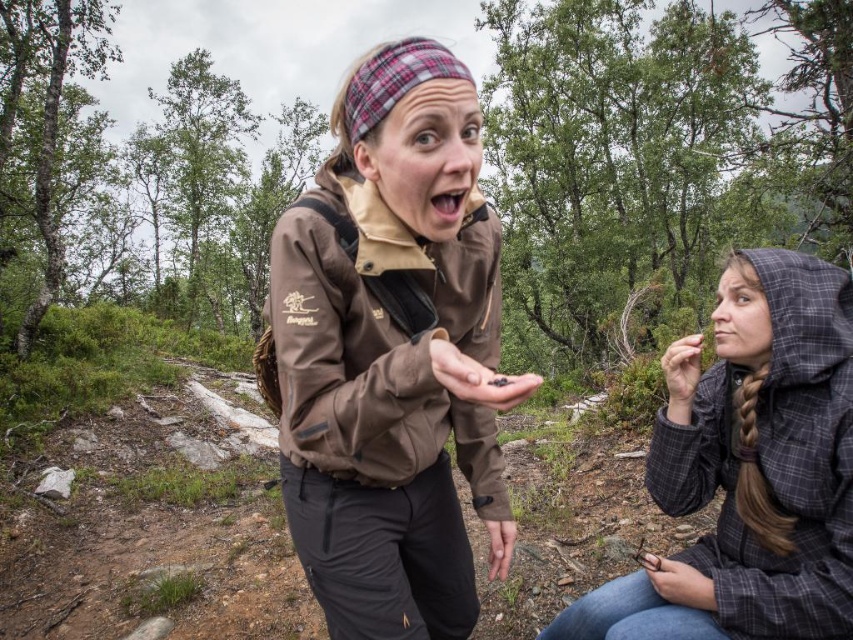
Question: Is the position of plaid fabric hood at lower right less distant than that of black matte seeds at center?

Choices:
 (A) yes
 (B) no

Answer: (B)

Question: Which of these objects is positioned farthest from the green leafy forest at center?

Choices:
 (A) brown softshell jacket at center
 (B) matte black hand at lower right
 (C) black matte seeds at center

Answer: (C)

Question: Is plaid fabric hood at lower right wider than matte black hand at lower right?

Choices:
 (A) no
 (B) yes

Answer: (B)

Question: Which point is farther to the camera?

Choices:
 (A) matte black hand at lower right
 (B) brown softshell jacket at center

Answer: (A)

Question: Can you confirm if black matte seeds at center is wider than matte black hand at lower right?

Choices:
 (A) yes
 (B) no

Answer: (A)

Question: Which is nearer to the black matte seeds at center?

Choices:
 (A) plaid fabric hood at lower right
 (B) matte black hand at lower right
 (C) green leafy forest at center
 (D) brown softshell jacket at center

Answer: (D)